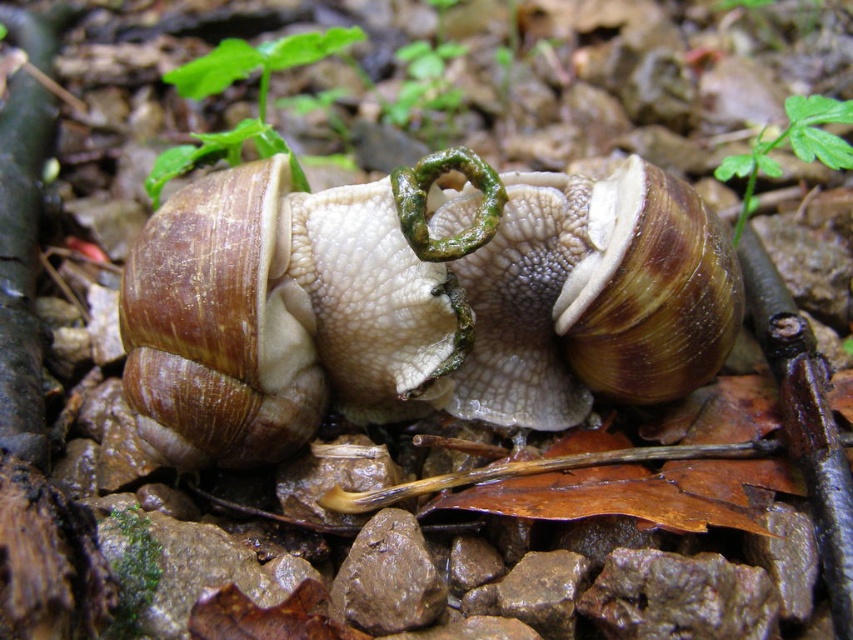
Question: Which of the following is the closest to the observer?

Choices:
 (A) (265, 420)
 (B) (660, 269)

Answer: (B)

Question: Is matte brown shell at center smaller than brown textured shell at center?

Choices:
 (A) no
 (B) yes

Answer: (A)

Question: Can you confirm if matte brown shell at center is wider than brown textured shell at center?

Choices:
 (A) no
 (B) yes

Answer: (B)

Question: Is matte brown shell at center above brown textured shell at center?

Choices:
 (A) no
 (B) yes

Answer: (B)

Question: Which point appears closest to the camera in this image?

Choices:
 (A) (409, 284)
 (B) (535, 232)

Answer: (A)